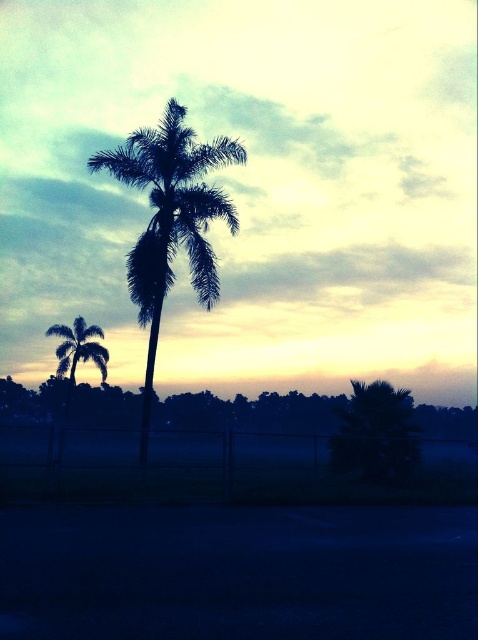
Question: Is green leafy palm at lower right further to camera compared to silhouette leafy palm at left?

Choices:
 (A) no
 (B) yes

Answer: (A)

Question: Which point is farther from the camera taking this photo?

Choices:
 (A) (156, 262)
 (B) (80, 360)
 (C) (394, 449)

Answer: (B)

Question: Does silhouette leafy palm at center have a larger size compared to silhouette leafy palm at left?

Choices:
 (A) yes
 (B) no

Answer: (A)

Question: Which point is closer to the camera taking this photo?

Choices:
 (A) (388, 406)
 (B) (141, 435)
 (C) (84, 339)

Answer: (B)

Question: Which object appears farthest from the camera in this image?

Choices:
 (A) silhouette leafy palm at center
 (B) silhouette leafy palm at left
 (C) green leafy palm at lower right

Answer: (B)

Question: Does silhouette leafy palm at center lie behind silhouette leafy palm at left?

Choices:
 (A) yes
 (B) no

Answer: (B)